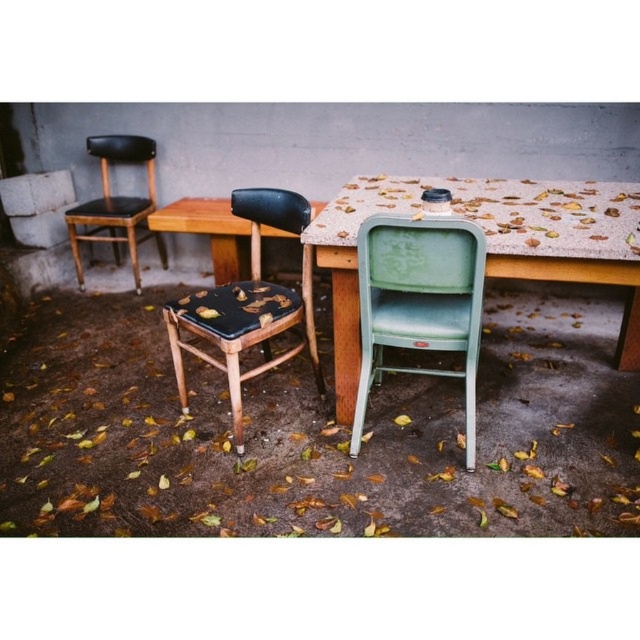
Can you confirm if speckled concrete table at center is positioned below matte black chair at left?

Correct, speckled concrete table at center is located below matte black chair at left.

Is speckled concrete table at center to the right of matte black chair at left from the viewer's perspective?

Indeed, speckled concrete table at center is positioned on the right side of matte black chair at left.

Which is behind, point (512, 262) or point (125, 148)?

Positioned behind is point (125, 148).

This screenshot has width=640, height=640. I want to click on speckled concrete table at center, so click(x=490, y=246).

Is the position of speckled concrete table at center less distant than that of green matte folding chair at center?

No.

Who is more forward, (593, 260) or (429, 228)?

Positioned in front is point (429, 228).

Is point (557, 227) closer to camera compared to point (412, 337)?

Yes, point (557, 227) is in front of point (412, 337).

You are a GUI agent. You are given a task and a screenshot of the screen. Output one action in this format:
    pyautogui.click(x=<x>, y=<y>)
    Task: Click on the speckled concrete table at center
    This screenshot has width=640, height=640.
    Given the screenshot: What is the action you would take?
    pyautogui.click(x=490, y=246)

Is matte black seat at center to the right of matte black chair at left from the viewer's perspective?

Yes, matte black seat at center is to the right of matte black chair at left.

How much distance is there between matte black seat at center and matte black chair at left?

They are 1.51 meters apart.

The image size is (640, 640). What are the coordinates of `matte black seat at center` in the screenshot? It's located at (248, 305).